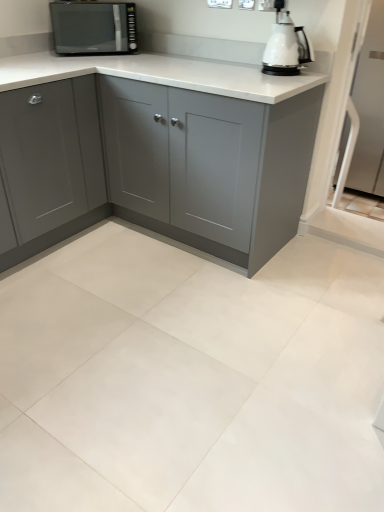
Question: Is satin black microwave at upper left oriented away from matte gray cabinet at left, the second cabinetry from the right?

Choices:
 (A) no
 (B) yes

Answer: (A)

Question: Is satin black microwave at upper left at the right side of matte gray cabinet at left, the second cabinetry from the right?

Choices:
 (A) yes
 (B) no

Answer: (A)

Question: Considering the relative sizes of satin black microwave at upper left and matte gray cabinet at left, which is counted as the first cabinetry, starting from the left, in the image provided, is satin black microwave at upper left wider than matte gray cabinet at left, which is counted as the first cabinetry, starting from the left,?

Choices:
 (A) yes
 (B) no

Answer: (B)

Question: Is satin black microwave at upper left positioned in front of matte gray cabinet at left, the second cabinetry from the right?

Choices:
 (A) no
 (B) yes

Answer: (A)

Question: Considering the relative positions of satin black microwave at upper left and matte gray cabinet at left, which is counted as the first cabinetry, starting from the left, in the image provided, is satin black microwave at upper left to the left of matte gray cabinet at left, which is counted as the first cabinetry, starting from the left, from the viewer's perspective?

Choices:
 (A) yes
 (B) no

Answer: (B)

Question: From a real-world perspective, is satin black microwave at upper left positioned above or below matte gray cabinet at left, the second cabinetry from the right?

Choices:
 (A) above
 (B) below

Answer: (A)

Question: Looking at the image, does satin black microwave at upper left seem bigger or smaller compared to matte gray cabinet at left, the second cabinetry from the right?

Choices:
 (A) small
 (B) big

Answer: (A)

Question: In terms of height, does satin black microwave at upper left look taller or shorter compared to matte gray cabinet at left, the second cabinetry from the right?

Choices:
 (A) short
 (B) tall

Answer: (A)

Question: Considering the positions of point (99, 38) and point (26, 181), is point (99, 38) closer or farther from the camera than point (26, 181)?

Choices:
 (A) farther
 (B) closer

Answer: (A)

Question: From the image's perspective, is matte gray cabinet at left, the second cabinetry from the right, positioned above or below matte gray cabinet at center, which is the first cabinetry in right-to-left order?

Choices:
 (A) above
 (B) below

Answer: (B)

Question: From a real-world perspective, is matte gray cabinet at left, the second cabinetry from the right, positioned above or below matte gray cabinet at center, the second cabinetry in the left-to-right sequence?

Choices:
 (A) below
 (B) above

Answer: (B)

Question: Is point (72, 93) closer or farther from the camera than point (97, 138)?

Choices:
 (A) farther
 (B) closer

Answer: (B)

Question: Is matte gray cabinet at left, the second cabinetry from the right, in front of or behind matte gray cabinet at center, which is the first cabinetry in right-to-left order, in the image?

Choices:
 (A) front
 (B) behind

Answer: (A)

Question: Looking at their shapes, would you say matte gray cabinet at left, the second cabinetry from the right, is wider or thinner than satin black microwave at upper left?

Choices:
 (A) wide
 (B) thin

Answer: (A)

Question: Considering their positions, is matte gray cabinet at left, which is counted as the first cabinetry, starting from the left, located in front of or behind satin black microwave at upper left?

Choices:
 (A) behind
 (B) front

Answer: (B)